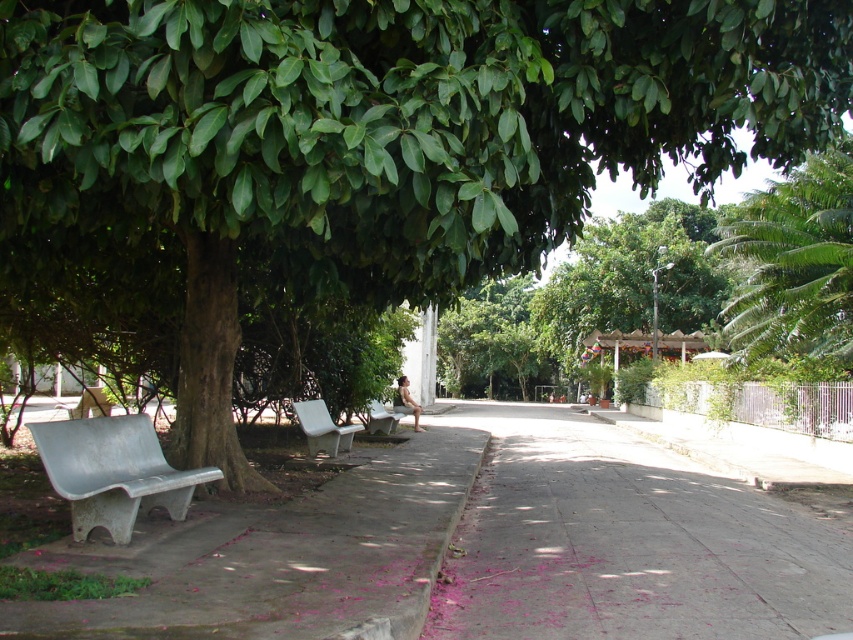
Question: Can you confirm if metallic gray bench at left is positioned below metallic silver bench at center?

Choices:
 (A) no
 (B) yes

Answer: (A)

Question: Considering the relative positions of gray concrete pavement at center and white plastic bench at center in the image provided, where is gray concrete pavement at center located with respect to white plastic bench at center?

Choices:
 (A) below
 (B) above

Answer: (A)

Question: Which of these objects is positioned farthest from the white plastic bench at center?

Choices:
 (A) metallic gray bench at left
 (B) metallic silver bench at center
 (C) gray concrete pavement at center

Answer: (A)

Question: Does white plastic bench at center appear on the left side of metallic silver bench at center?

Choices:
 (A) yes
 (B) no

Answer: (A)

Question: Which of the following is the farthest from the observer?

Choices:
 (A) gray concrete pavement at center
 (B) metallic silver bench at center

Answer: (B)

Question: Which object is the closest to the metallic silver bench at center?

Choices:
 (A) white plastic bench at center
 (B) gray concrete pavement at center
 (C) metallic gray bench at left

Answer: (A)